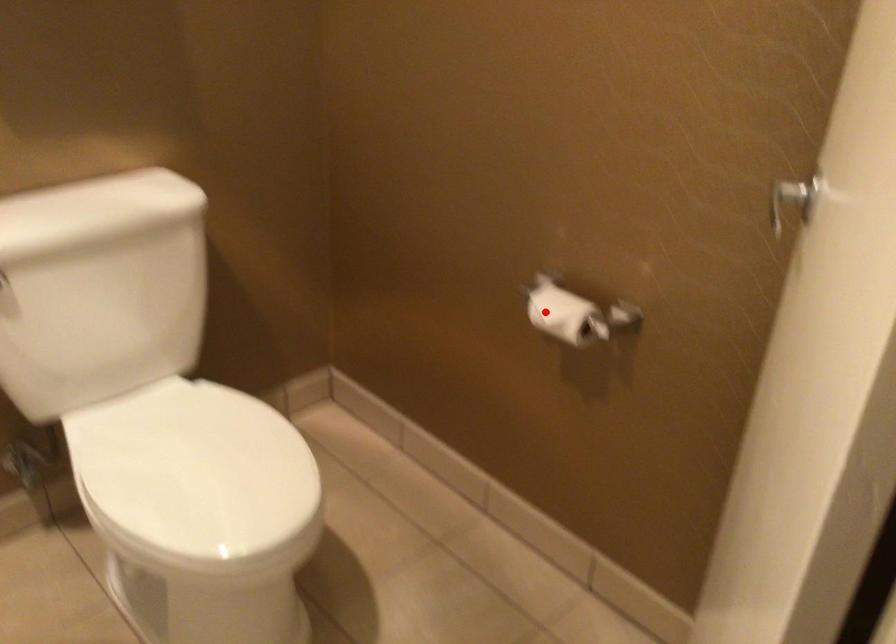
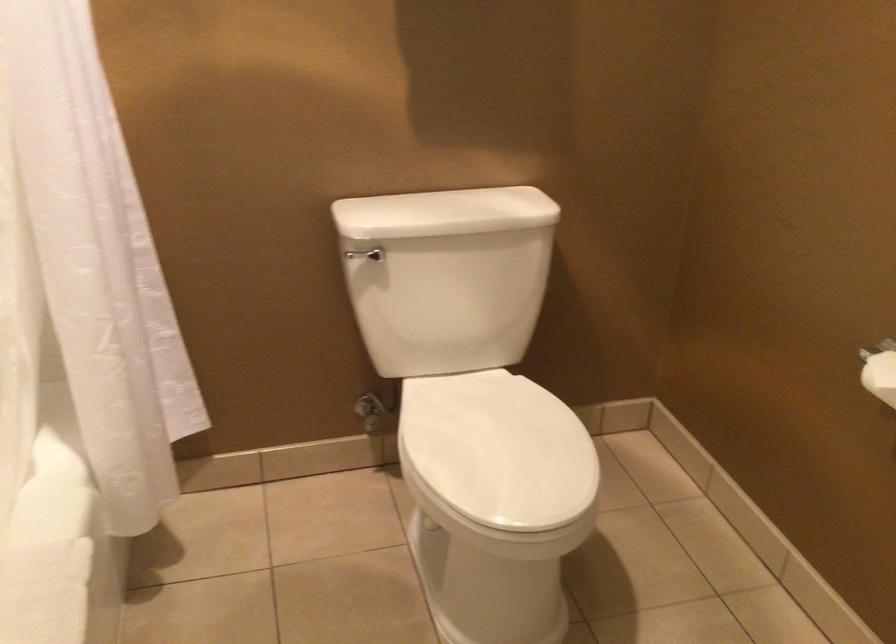
The point at the highlighted location is marked in the first image. Where is the corresponding point in the second image?

(880, 375)